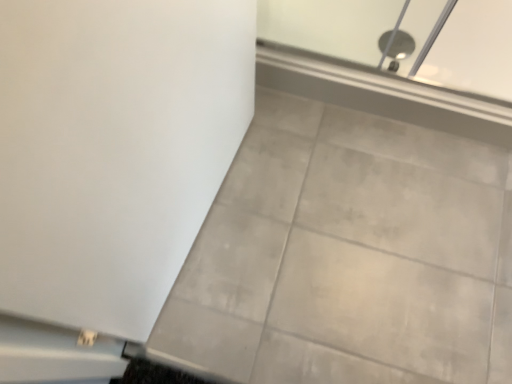
The width and height of the screenshot is (512, 384). I want to click on clear glass mirror at upper right, so click(x=473, y=50).

Describe the element at coordinates (473, 50) in the screenshot. I see `clear glass mirror at upper right` at that location.

The width and height of the screenshot is (512, 384). I want to click on clear glass mirror at upper right, so click(473, 50).